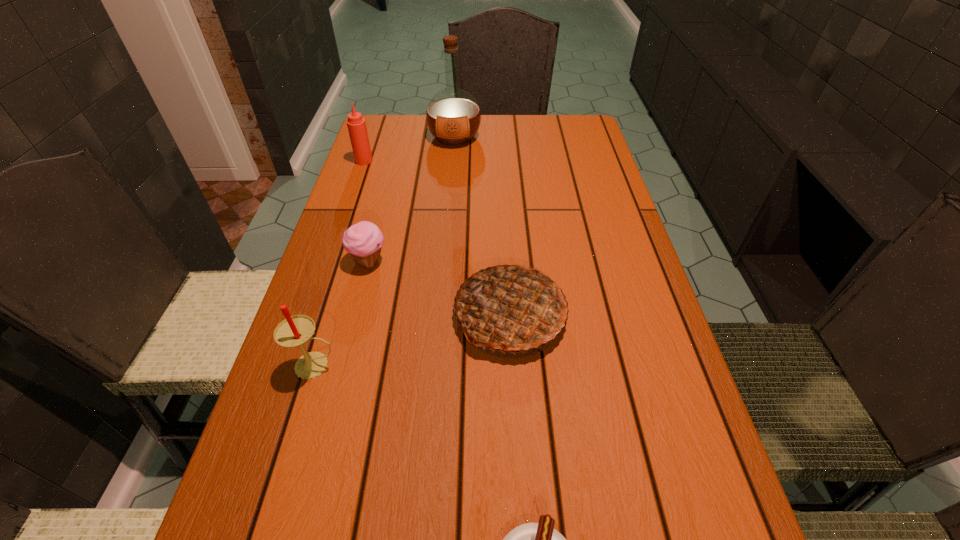
At what (x,y) coordinates should I click in order to perform the action: click on liquor. Please return your answer as a coordinate pair (x, y). This screenshot has width=960, height=540. Looking at the image, I should click on (453, 116).

This screenshot has height=540, width=960. Find the location of `the tallest object`. the tallest object is located at coordinates (453, 116).

Locate an element on the screen. This screenshot has height=540, width=960. Tabasco sauce is located at coordinates (356, 124).

This screenshot has height=540, width=960. In order to click on pie in this screenshot , I will do `click(511, 308)`.

This screenshot has width=960, height=540. I want to click on candle, so click(x=294, y=331).

At what (x,y) coordinates should I click in order to perform the action: click on cupcake. Please return your answer as a coordinate pair (x, y). Image resolution: width=960 pixels, height=540 pixels. Looking at the image, I should click on (364, 240).

Where is `the second shortest object`? the second shortest object is located at coordinates (364, 240).

The width and height of the screenshot is (960, 540). In order to click on blank area located on the front label of the tallest object in this screenshot , I will do `click(452, 167)`.

Image resolution: width=960 pixels, height=540 pixels. Find the location of `vacant space situated 0.240m on the back of the second farthest object`. vacant space situated 0.240m on the back of the second farthest object is located at coordinates (378, 119).

You are a GUI agent. You are given a task and a screenshot of the screen. Output one action in this format:
    pyautogui.click(x=<x>, y=<y>)
    Task: Click on the free location located 0.240m on the front of the pie
    This screenshot has width=960, height=540.
    Given the screenshot: What is the action you would take?
    pyautogui.click(x=521, y=499)